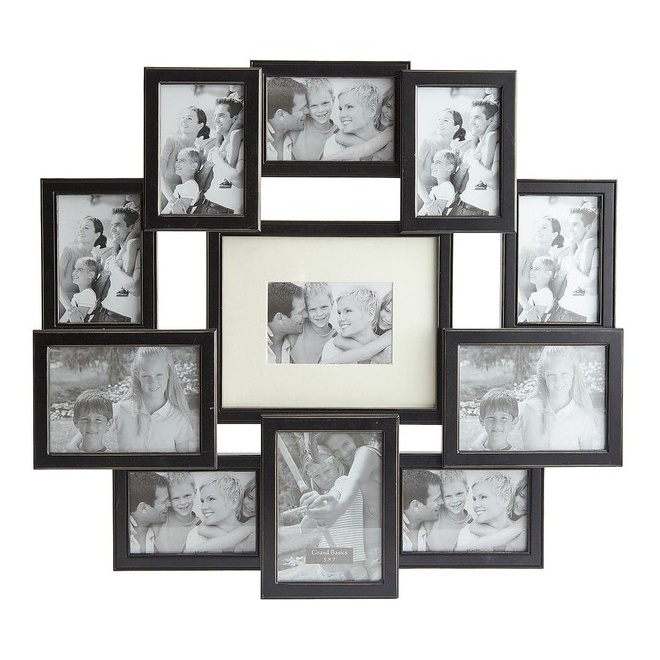
Image resolution: width=660 pixels, height=660 pixels. Find the location of `pictures`. pictures is located at coordinates 73,214, 172,110, 311,92, 439,96, 558,226, 497,366, 432,490, 297,459, 154,490, 319,298.